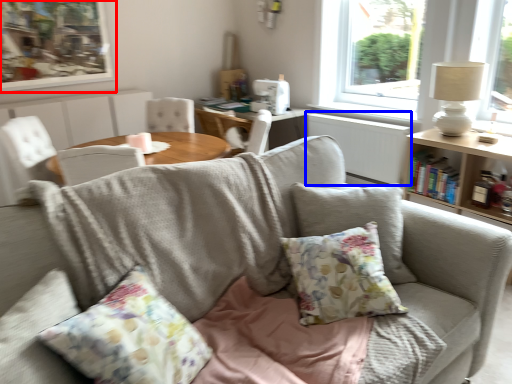
Question: Among these objects, which one is farthest to the camera, picture frame (highlighted by a red box) or radiator (highlighted by a blue box)?

Choices:
 (A) picture frame
 (B) radiator

Answer: (A)